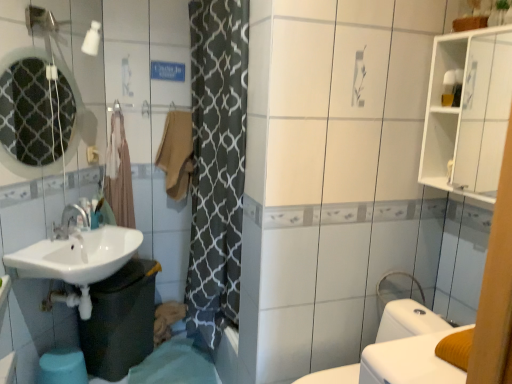
Question: Is beige fabric towel at center to the right of brown fabric shower curtain at left from the viewer's perspective?

Choices:
 (A) yes
 (B) no

Answer: (A)

Question: From a real-world perspective, is beige fabric towel at center positioned under brown fabric shower curtain at left based on gravity?

Choices:
 (A) yes
 (B) no

Answer: (B)

Question: Does beige fabric towel at center have a smaller size compared to brown fabric shower curtain at left?

Choices:
 (A) no
 (B) yes

Answer: (B)

Question: Is beige fabric towel at center thinner than brown fabric shower curtain at left?

Choices:
 (A) yes
 (B) no

Answer: (B)

Question: Is there a large distance between beige fabric towel at center and brown fabric shower curtain at left?

Choices:
 (A) yes
 (B) no

Answer: (B)

Question: Is beige fabric towel at center directly adjacent to brown fabric shower curtain at left?

Choices:
 (A) no
 (B) yes

Answer: (A)

Question: Is brown fabric shower curtain at left not near white glossy bidet at lower right?

Choices:
 (A) yes
 (B) no

Answer: (A)

Question: Does brown fabric shower curtain at left have a lesser height compared to white glossy bidet at lower right?

Choices:
 (A) yes
 (B) no

Answer: (B)

Question: Is brown fabric shower curtain at left to the right of white glossy bidet at lower right from the viewer's perspective?

Choices:
 (A) no
 (B) yes

Answer: (A)

Question: Is brown fabric shower curtain at left oriented towards white glossy bidet at lower right?

Choices:
 (A) yes
 (B) no

Answer: (B)

Question: From the image's perspective, is brown fabric shower curtain at left under white glossy bidet at lower right?

Choices:
 (A) no
 (B) yes

Answer: (A)

Question: Does brown fabric shower curtain at left have a lesser width compared to white glossy bidet at lower right?

Choices:
 (A) no
 (B) yes

Answer: (B)

Question: Considering the relative sizes of white glossy medicine cabinet at upper right and white glossy sink at lower left in the image provided, is white glossy medicine cabinet at upper right thinner than white glossy sink at lower left?

Choices:
 (A) yes
 (B) no

Answer: (A)